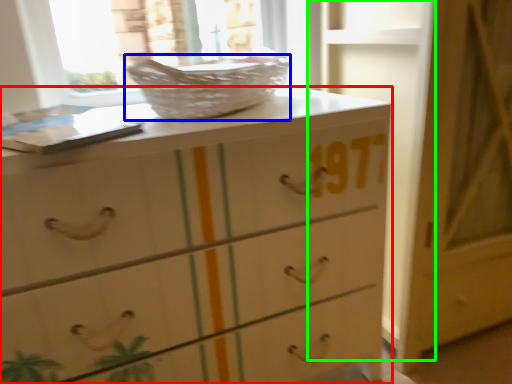
Question: Which is farther away from chest of drawers (highlighted by a red box)? basket (highlighted by a blue box) or door (highlighted by a green box)?

Choices:
 (A) basket
 (B) door

Answer: (B)